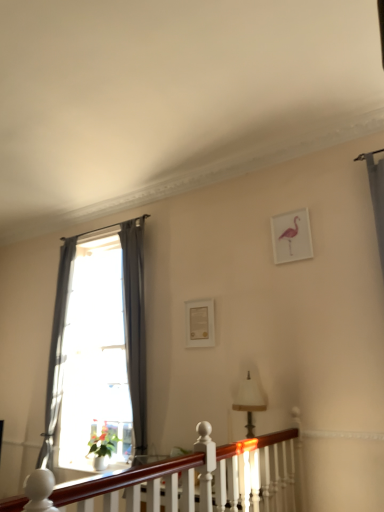
Question: Is mahogany wood balustrade at lower center behind pink matte picture frame at upper right, the 1th picture frame positioned from the top?

Choices:
 (A) yes
 (B) no

Answer: (B)

Question: Is pink matte picture frame at upper right, which is the 2th picture frame from left to right, a part of mahogany wood balustrade at lower center?

Choices:
 (A) yes
 (B) no

Answer: (B)

Question: Does mahogany wood balustrade at lower center have a greater height compared to pink matte picture frame at upper right, the 1th picture frame in the front-to-back sequence?

Choices:
 (A) yes
 (B) no

Answer: (A)

Question: From a real-world perspective, is mahogany wood balustrade at lower center beneath pink matte picture frame at upper right, the 1th picture frame in the front-to-back sequence?

Choices:
 (A) no
 (B) yes

Answer: (B)

Question: Does mahogany wood balustrade at lower center have a lesser height compared to pink matte picture frame at upper right, which ranks as the 2th picture frame in bottom-to-top order?

Choices:
 (A) yes
 (B) no

Answer: (B)

Question: Is point (294, 240) closer or farther from the camera than point (57, 367)?

Choices:
 (A) farther
 (B) closer

Answer: (B)

Question: Is pink matte picture frame at upper right, placed as the 1th picture frame when sorted from right to left, bigger or smaller than gray fabric curtain at left, the second curtain in the right-to-left sequence?

Choices:
 (A) big
 (B) small

Answer: (B)

Question: Visually, is pink matte picture frame at upper right, which ranks as the 2th picture frame in bottom-to-top order, positioned to the left or to the right of gray fabric curtain at left, the second curtain in the right-to-left sequence?

Choices:
 (A) left
 (B) right

Answer: (B)

Question: From a real-world perspective, is pink matte picture frame at upper right, which ranks as the 2th picture frame in bottom-to-top order, physically located above or below gray fabric curtain at left, the second curtain in the right-to-left sequence?

Choices:
 (A) above
 (B) below

Answer: (A)

Question: Considering their positions, is gray fabric curtain at left, the second curtain in the right-to-left sequence, located in front of or behind green matte flower at lower left?

Choices:
 (A) behind
 (B) front

Answer: (A)

Question: In terms of size, does gray fabric curtain at left, the 1th curtain when ordered from left to right, appear bigger or smaller than green matte flower at lower left?

Choices:
 (A) small
 (B) big

Answer: (B)

Question: Is point (59, 321) closer or farther from the camera than point (94, 451)?

Choices:
 (A) closer
 (B) farther

Answer: (B)

Question: In the image, is gray fabric curtain at left, the 1th curtain when ordered from left to right, on the left side or the right side of green matte flower at lower left?

Choices:
 (A) left
 (B) right

Answer: (A)

Question: From the image's perspective, is matte white picture frame at center, which is the second picture frame from right to left, above or below green matte flower at lower left?

Choices:
 (A) below
 (B) above

Answer: (B)

Question: Looking at the image, does matte white picture frame at center, which is the first picture frame in left-to-right order, seem bigger or smaller compared to green matte flower at lower left?

Choices:
 (A) small
 (B) big

Answer: (A)